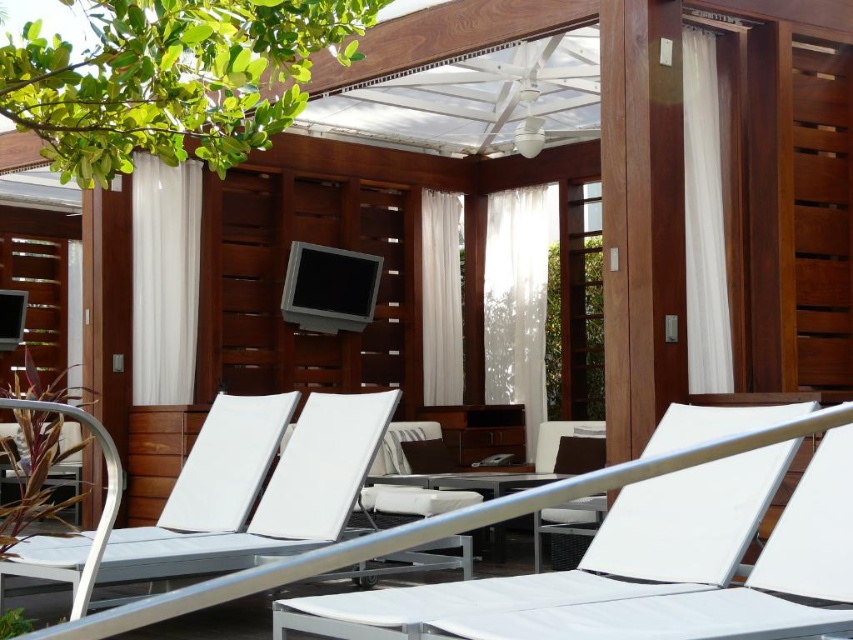
Question: Which point is farther to the camera?

Choices:
 (A) white matte lounge chair at center
 (B) white fabric chair at center

Answer: (A)

Question: Is white fabric chair at center positioned behind white matte lounge chair at center?

Choices:
 (A) no
 (B) yes

Answer: (A)

Question: In this image, where is white fabric chair at center located relative to white matte lounge chair at center?

Choices:
 (A) right
 (B) left

Answer: (A)

Question: Can you confirm if white fabric chair at center is positioned above white matte lounge chair at center?

Choices:
 (A) no
 (B) yes

Answer: (B)

Question: Which of the following is the farthest from the observer?

Choices:
 (A) (287, 420)
 (B) (606, 588)

Answer: (A)